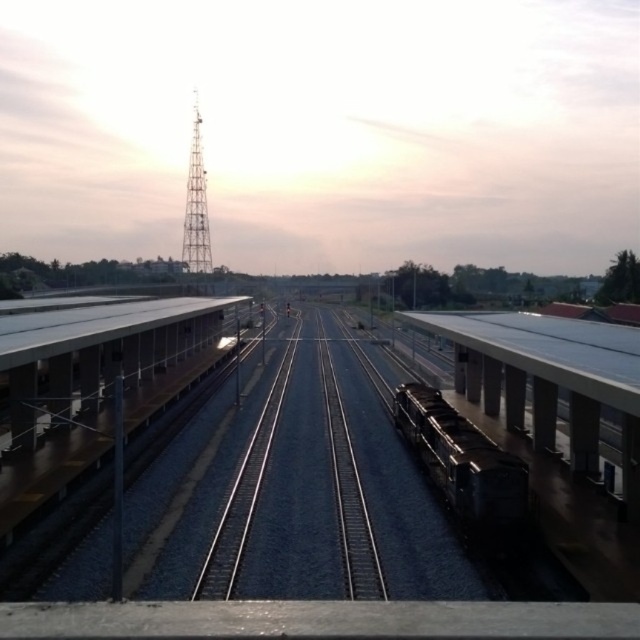
Question: Does shiny black train at center have a lesser width compared to metallic lattice tower at center?

Choices:
 (A) no
 (B) yes

Answer: (B)

Question: Does metal/smooth train track at center appear on the left side of shiny black train at center?

Choices:
 (A) no
 (B) yes

Answer: (B)

Question: Can you confirm if shiny black train at center is positioned below metallic lattice tower at center?

Choices:
 (A) no
 (B) yes

Answer: (B)

Question: Which object appears farthest from the camera in this image?

Choices:
 (A) metal/smooth train track at center
 (B) metallic lattice tower at center
 (C) shiny black train at center

Answer: (B)

Question: Which of these objects is positioned closest to the shiny black train at center?

Choices:
 (A) metallic lattice tower at center
 (B) metal/smooth train track at center

Answer: (B)

Question: Which of the following is the closest to the observer?

Choices:
 (A) metal/smooth train track at center
 (B) metallic lattice tower at center
 (C) shiny black train at center

Answer: (A)